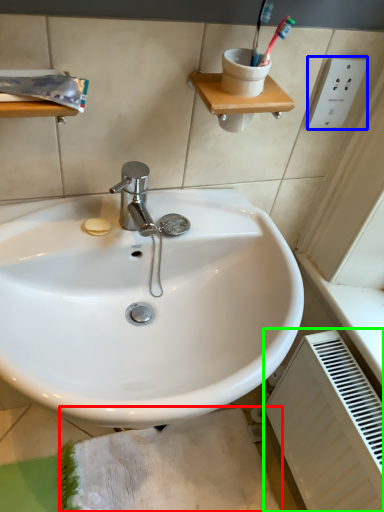
Question: Based on their relative distances, which object is farther from bath mat (highlighted by a red box)? Choose from electric outlet (highlighted by a blue box) and radiator (highlighted by a green box).

Choices:
 (A) electric outlet
 (B) radiator

Answer: (A)